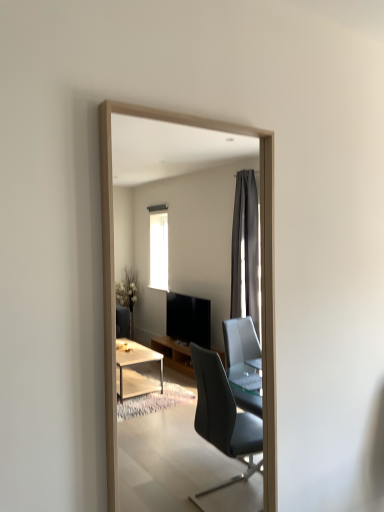
Where is `light wood frame mirror at center`? The width and height of the screenshot is (384, 512). light wood frame mirror at center is located at coordinates tap(262, 283).

What do you see at coordinates (262, 283) in the screenshot?
I see `light wood frame mirror at center` at bounding box center [262, 283].

Find the location of a particular element. The height and width of the screenshot is (512, 384). light wood frame mirror at center is located at coordinates (262, 283).